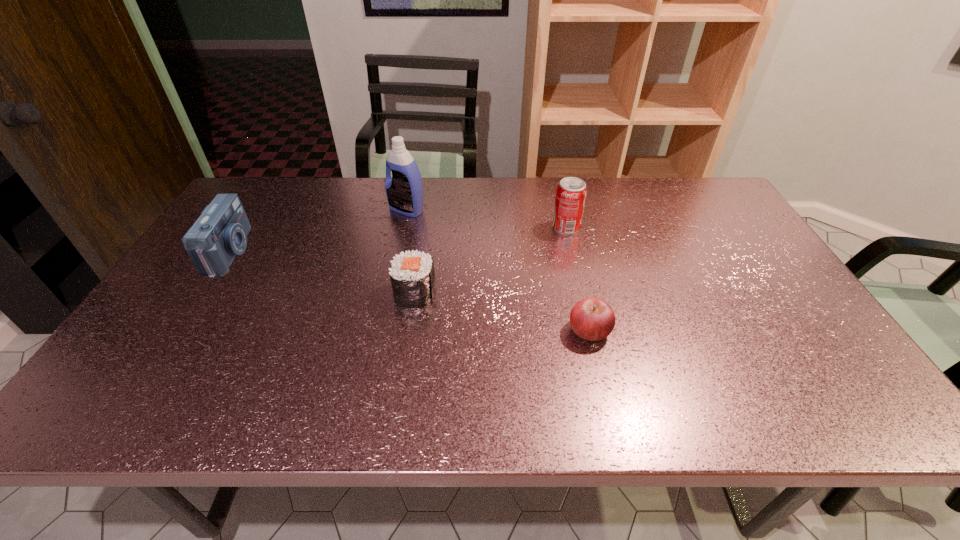
Identify the location of object that ranks as the second closest to the leftmost object. pyautogui.click(x=412, y=275).

Locate an element on the screen. free location that satisfies the following two spatial constraints: 1. on the lens of the third tallest object; 2. on the back side of the apple is located at coordinates (180, 330).

Identify the location of vacant region that satisfies the following two spatial constraints: 1. on the lens of the leftmost object; 2. on the left side of the nearest object. (180, 330).

Locate an element on the screen. Image resolution: width=960 pixels, height=540 pixels. free region that satisfies the following two spatial constraints: 1. on the front side of the detergent; 2. on the right side of the sushi is located at coordinates (389, 293).

Identify the location of vacant space that satisfies the following two spatial constraints: 1. on the back side of the soda can; 2. on the right side of the sushi. The image size is (960, 540). (425, 227).

The width and height of the screenshot is (960, 540). Identify the location of vacant space that satisfies the following two spatial constraints: 1. on the front side of the detergent; 2. on the right side of the soda can. (403, 227).